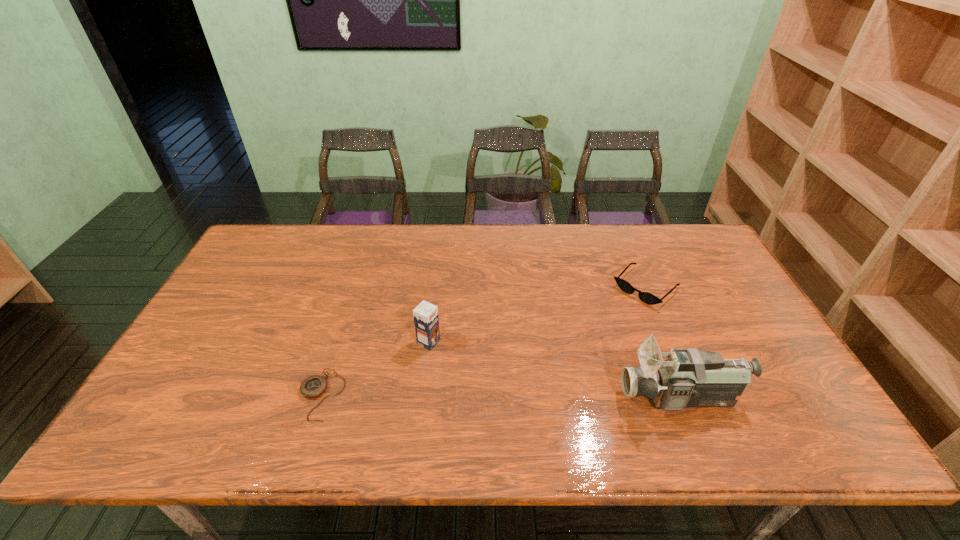
Where is `pocket watch`? pocket watch is located at coordinates (314, 386).

Identify the location of the leftmost object. Image resolution: width=960 pixels, height=540 pixels. (314, 386).

Locate an element on the screen. camcorder is located at coordinates (690, 377).

Locate an element on the screen. the third tallest object is located at coordinates (648, 298).

The height and width of the screenshot is (540, 960). Identify the location of sunglasses. (648, 298).

Where is `the second object from left to right`? the second object from left to right is located at coordinates (426, 320).

This screenshot has width=960, height=540. What are the coordinates of `chocolate milk` in the screenshot? It's located at (x=426, y=320).

Image resolution: width=960 pixels, height=540 pixels. I want to click on vacant space located on the left of the shortest object, so click(x=267, y=395).

I want to click on blank space located on the front-facing side of the camcorder, so click(x=576, y=397).

The width and height of the screenshot is (960, 540). I want to click on vacant space located 0.360m on the front-facing side of the camcorder, so click(471, 397).